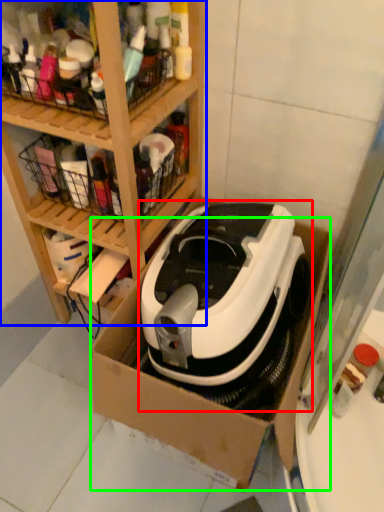
Question: Estimate the real-world distances between objects in this image. Which object is farther from home appliance (highlighted by a red box), shelf (highlighted by a blue box) or cardboard box (highlighted by a green box)?

Choices:
 (A) shelf
 (B) cardboard box

Answer: (A)